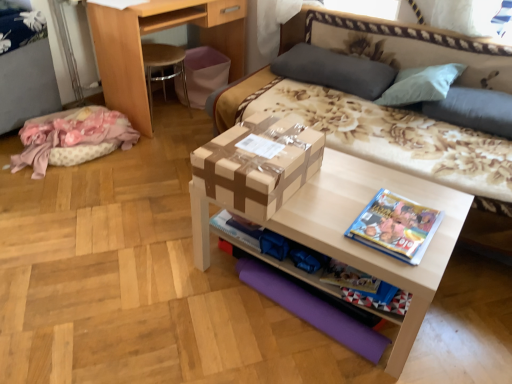
Identify the location of vacant area that is in front of pink fabric at left. The width and height of the screenshot is (512, 384). (58, 205).